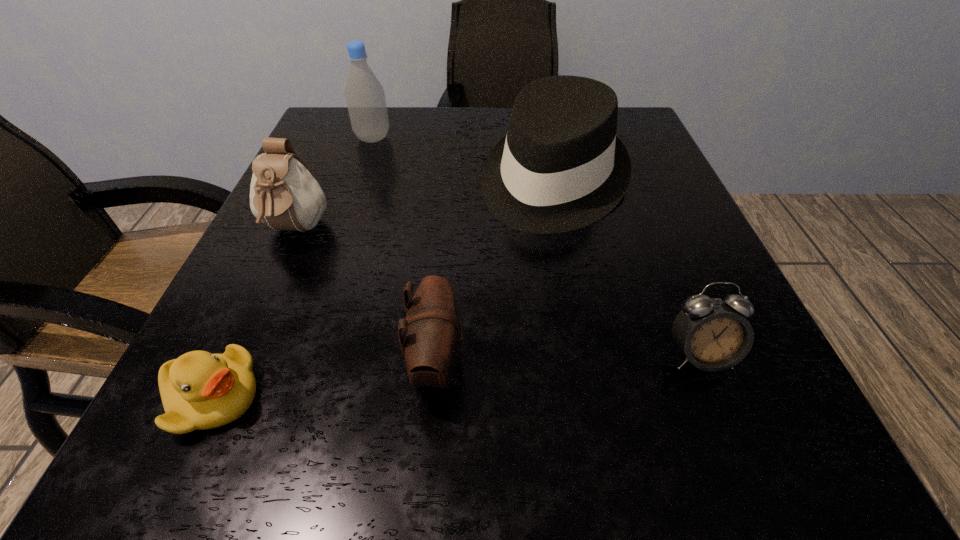
Find the location of `unoccupied position between the shortest object and the alarm clock`. unoccupied position between the shortest object and the alarm clock is located at coordinates (456, 376).

You are a GUI agent. You are given a task and a screenshot of the screen. Output one action in this format:
    pyautogui.click(x=<x>, y=<y>)
    Task: Click on the unoccupied position between the fedora and the third object from right to left
    This screenshot has width=960, height=540.
    Given the screenshot: What is the action you would take?
    pyautogui.click(x=495, y=273)

This screenshot has height=540, width=960. In order to click on the closest object to the tallest object in this screenshot , I will do `click(561, 167)`.

Point out which object is positioned as the third nearest to the right pouch. Please provide its 2D coordinates. Your answer should be formatted as a tuple, i.e. [(x, y)], where the tuple contains the x and y coordinates of a point satisfying the conditions above.

[(284, 195)]